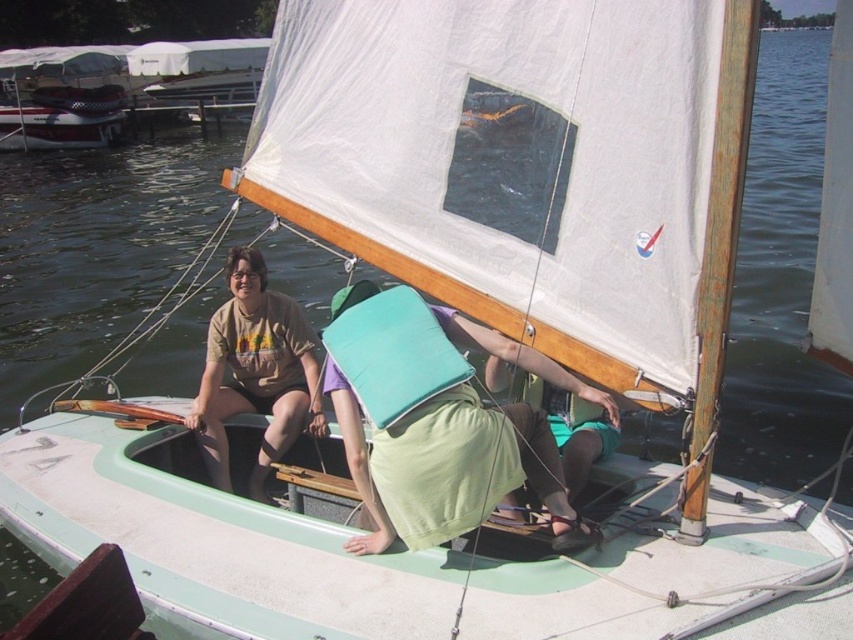
Measure the distance between matte green cushion at center and brown cotton t-shirt at center.

matte green cushion at center and brown cotton t-shirt at center are 4.05 feet apart.

From the picture: Does matte green cushion at center appear on the left side of brown cotton t-shirt at center?

No, matte green cushion at center is not to the left of brown cotton t-shirt at center.

Describe the element at coordinates (448, 467) in the screenshot. The image size is (853, 640). I see `matte green cushion at center` at that location.

Find the location of `matte green cushion at center`. matte green cushion at center is located at coordinates (448, 467).